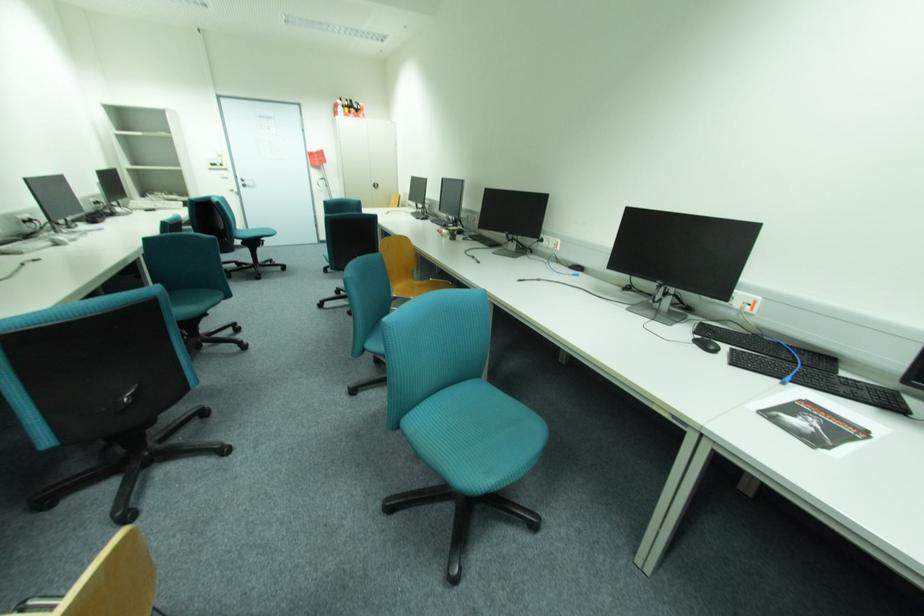
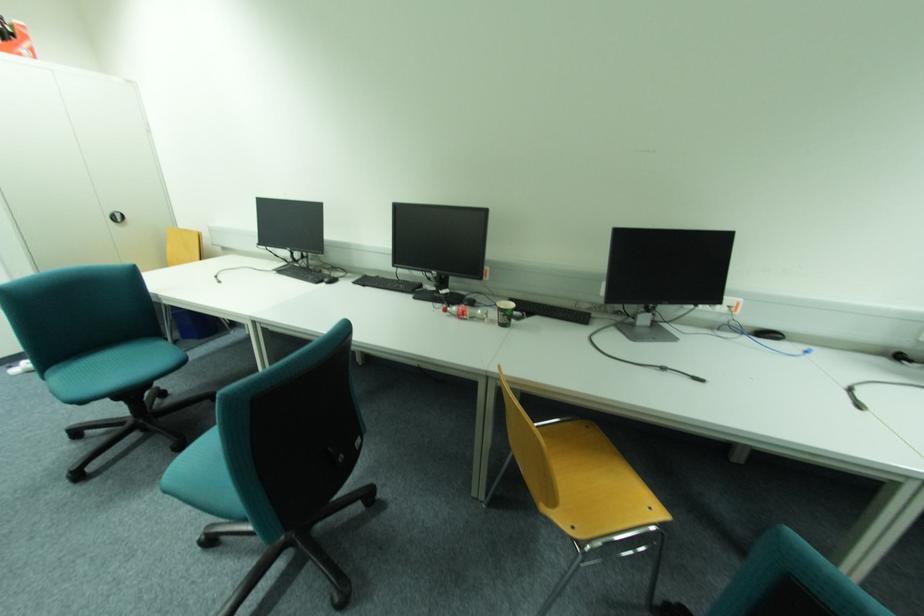
In the second image, find the point that corresponds to point 382,185 in the first image.

(126, 219)